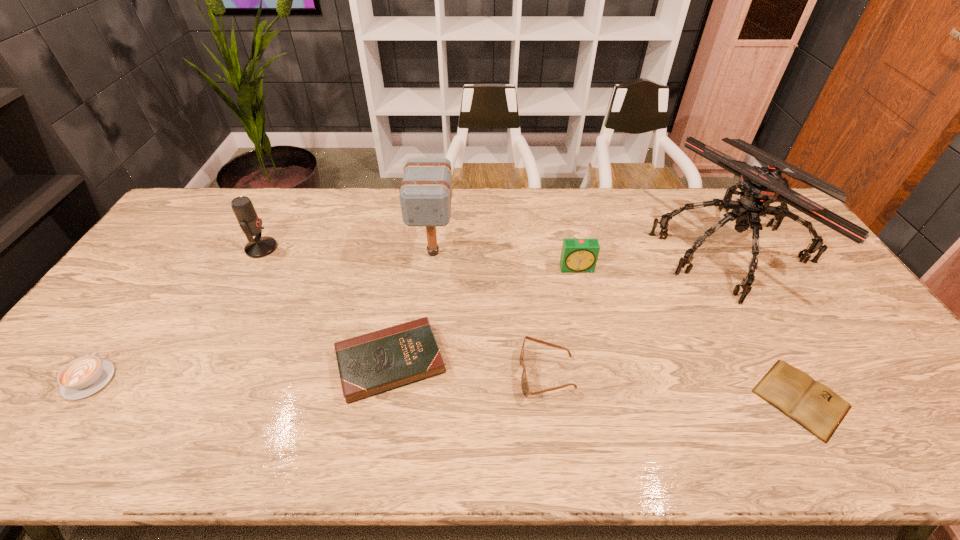
Where is `free spot between the fourth object from right to left and the drone`? The width and height of the screenshot is (960, 540). free spot between the fourth object from right to left and the drone is located at coordinates (638, 311).

Identify the location of free space between the fifth shortest object and the sunglasses. (563, 321).

Locate an element on the screen. Image resolution: width=960 pixels, height=540 pixels. object that is the sixth nearest to the mallet is located at coordinates (82, 377).

I want to click on object that stands as the closest to the shortest object, so click(x=760, y=186).

Where is `vacant region that satisfies the following two spatial constraints: 1. on the side of the third tallest object with the red ring; 2. on the left side of the book`? The image size is (960, 540). vacant region that satisfies the following two spatial constraints: 1. on the side of the third tallest object with the red ring; 2. on the left side of the book is located at coordinates (x=181, y=399).

Locate an element on the screen. The width and height of the screenshot is (960, 540). free space that satisfies the following two spatial constraints: 1. on the side of the Bible with the red ring; 2. on the right side of the third tallest object is located at coordinates (202, 362).

Where is `free point that satisfies the following two spatial constraints: 1. on the side of the Bible with the red ring; 2. on the left side of the microphone`? free point that satisfies the following two spatial constraints: 1. on the side of the Bible with the red ring; 2. on the left side of the microphone is located at coordinates (202, 362).

Identify the location of blank space that satisfies the following two spatial constraints: 1. on the side of the leftmost object with the handle; 2. on the left side of the Bible. Image resolution: width=960 pixels, height=540 pixels. (103, 362).